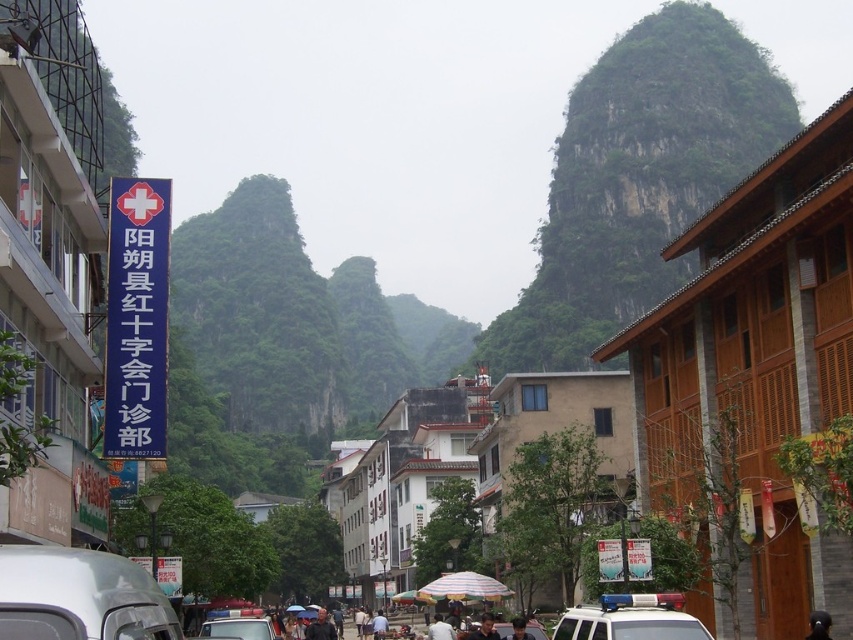
Can you confirm if green rocky mountain at center is positioned below dark brown leather jacket at center?

No, green rocky mountain at center is not below dark brown leather jacket at center.

Is green rocky mountain at center positioned behind dark brown leather jacket at center?

Yes, green rocky mountain at center is behind dark brown leather jacket at center.

Where is `green rocky mountain at center`? green rocky mountain at center is located at coordinates (637, 179).

Find the location of a particular element. The image size is (853, 640). green rocky mountain at center is located at coordinates (637, 179).

Does white matte car at lower left appear under dark brown leather jacket at center?

No.

Does white matte car at lower left have a greater width compared to dark brown leather jacket at center?

No.

Does point (138, 602) come farther from viewer compared to point (525, 627)?

No, (138, 602) is in front of (525, 627).

Locate an element on the screen. The width and height of the screenshot is (853, 640). white matte car at lower left is located at coordinates (79, 596).

Does green rocky mountain at center have a larger size compared to white fabric umbrella at center?

Yes.

Who is more distant from viewer, (608, 208) or (451, 637)?

The point (608, 208) is behind.

The height and width of the screenshot is (640, 853). Describe the element at coordinates (637, 179) in the screenshot. I see `green rocky mountain at center` at that location.

Where is `green rocky mountain at center`? green rocky mountain at center is located at coordinates (637, 179).